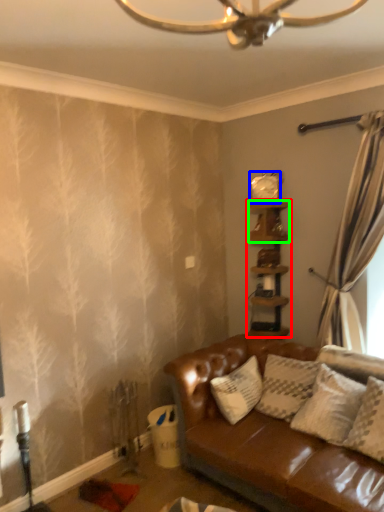
Question: Considering the real-world distances, which object is farthest from shelf (highlighted by a red box)? clock (highlighted by a blue box) or shelf (highlighted by a green box)?

Choices:
 (A) clock
 (B) shelf

Answer: (A)